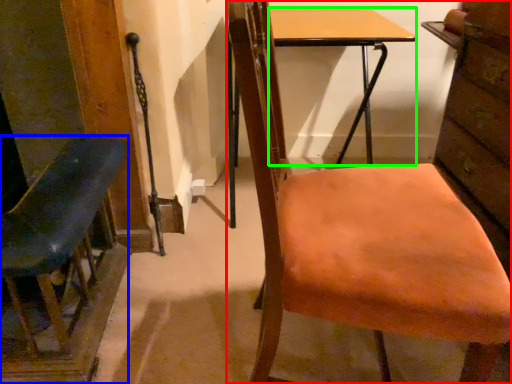
Question: Estimate the real-world distances between objects in this image. Which object is closer to chair (highlighted by a red box), chair (highlighted by a blue box) or desk (highlighted by a green box)?

Choices:
 (A) chair
 (B) desk

Answer: (A)